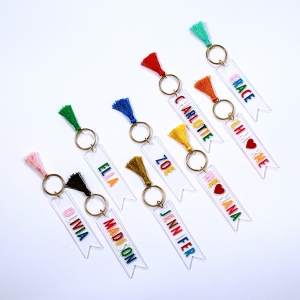
Image resolution: width=300 pixels, height=300 pixels. I want to click on brown tassel, so click(142, 164).